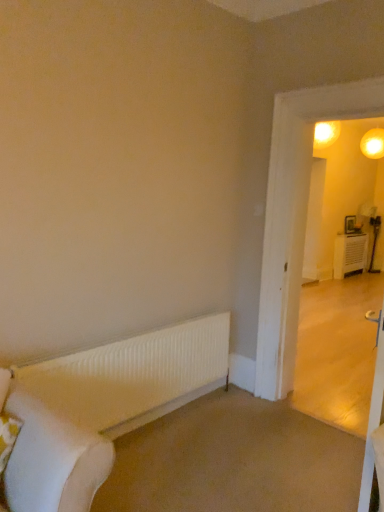
Identify the location of vacant space to the right of white ribbed radiator at lower left. [241, 433].